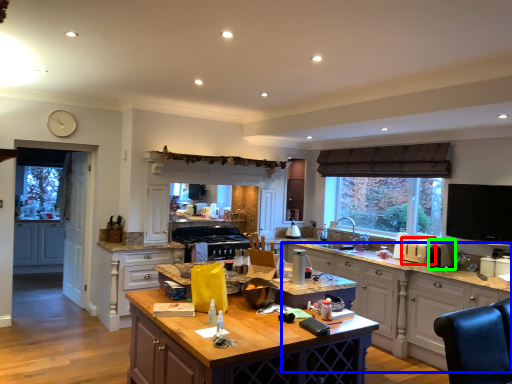
Question: Which object is the farthest from appliance (highlighted by a red box)? Choose among these: cabinetry (highlighted by a blue box) or appliance (highlighted by a green box).

Choices:
 (A) cabinetry
 (B) appliance

Answer: (A)